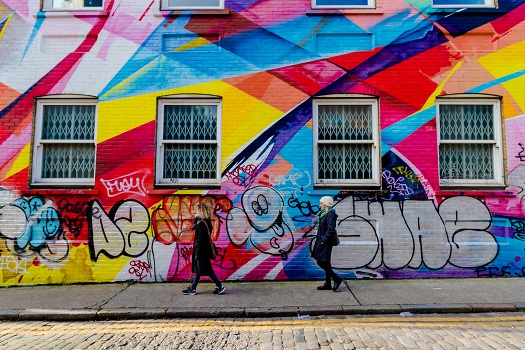
The height and width of the screenshot is (350, 525). What are the coordinates of `brick wall` in the screenshot? It's located at (267, 64).